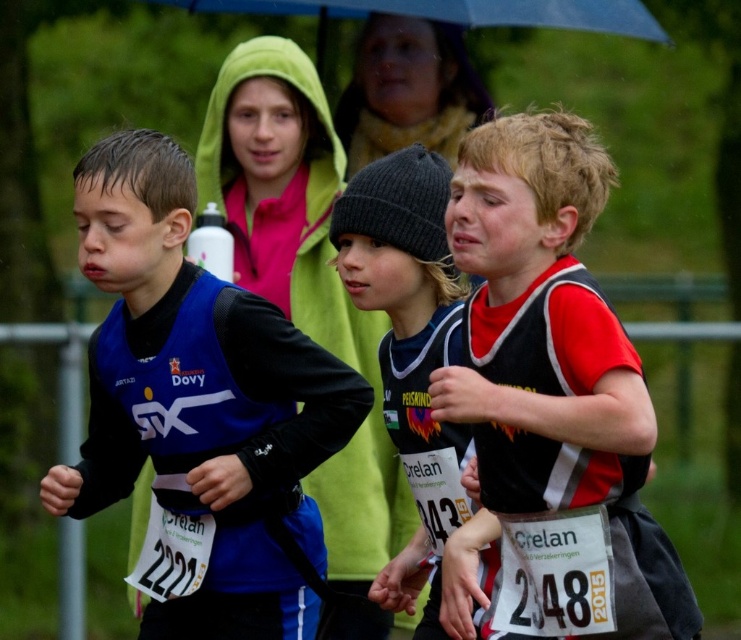
Is point (173, 193) less distant than point (614, 534)?

No, (173, 193) is behind (614, 534).

Who is more distant from viewer, (332, 372) or (551, 448)?

The point (332, 372) is more distant.

Where is `blue matte vest at center`? The image size is (741, 640). blue matte vest at center is located at coordinates (202, 403).

Which is more to the right, red and black jersey at center or knit black beanie at center?

red and black jersey at center is more to the right.

Is red and black jersey at center wider than knit black beanie at center?

Yes, red and black jersey at center is wider than knit black beanie at center.

Measure the distance between red and black jersey at center and camera.

red and black jersey at center and camera are 3.65 meters apart from each other.

Locate an element on the screen. Image resolution: width=741 pixels, height=640 pixels. red and black jersey at center is located at coordinates (554, 356).

This screenshot has height=640, width=741. What do you see at coordinates (202, 403) in the screenshot?
I see `blue matte vest at center` at bounding box center [202, 403].

Between point (256, 460) and point (199, 170), which one is positioned in front?

Point (256, 460) is in front.

Image resolution: width=741 pixels, height=640 pixels. Identify the location of blue matte vest at center. (202, 403).